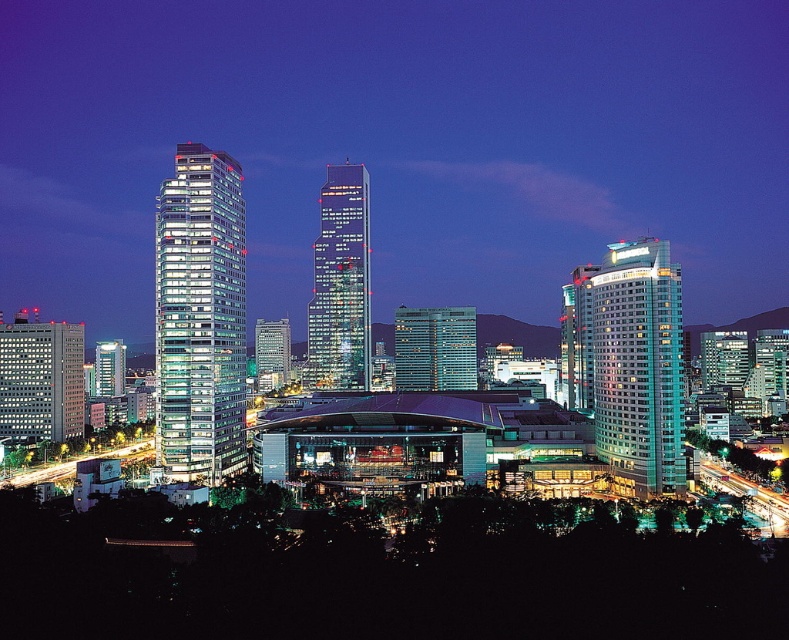
Question: Does glass skyscraper at center come behind matte glass skyscraper at left?

Choices:
 (A) no
 (B) yes

Answer: (B)

Question: Which object appears closest to the camera in this image?

Choices:
 (A) shiny glass skyscraper at right
 (B) matte glass skyscraper at left
 (C) glassy modern skyscraper at left

Answer: (A)

Question: Does glassy modern skyscraper at left come in front of glassy steel skyscraper at center?

Choices:
 (A) yes
 (B) no

Answer: (A)

Question: Which object is the closest to the matte glass skyscraper at left?

Choices:
 (A) glassy modern skyscraper at left
 (B) shiny glass skyscraper at right
 (C) glassy steel skyscraper at center

Answer: (A)

Question: Which point appears closest to the camera in this image?

Choices:
 (A) (612, 396)
 (B) (466, 364)
 (C) (335, 360)

Answer: (A)

Question: Can you confirm if glassy modern skyscraper at left is bigger than glassy steel skyscraper at center?

Choices:
 (A) no
 (B) yes

Answer: (B)